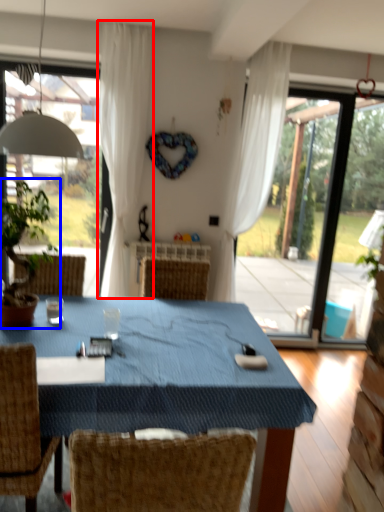
Question: Which point is closer to the camera, curtain (highlighted by a red box) or houseplant (highlighted by a blue box)?

Choices:
 (A) curtain
 (B) houseplant

Answer: (B)